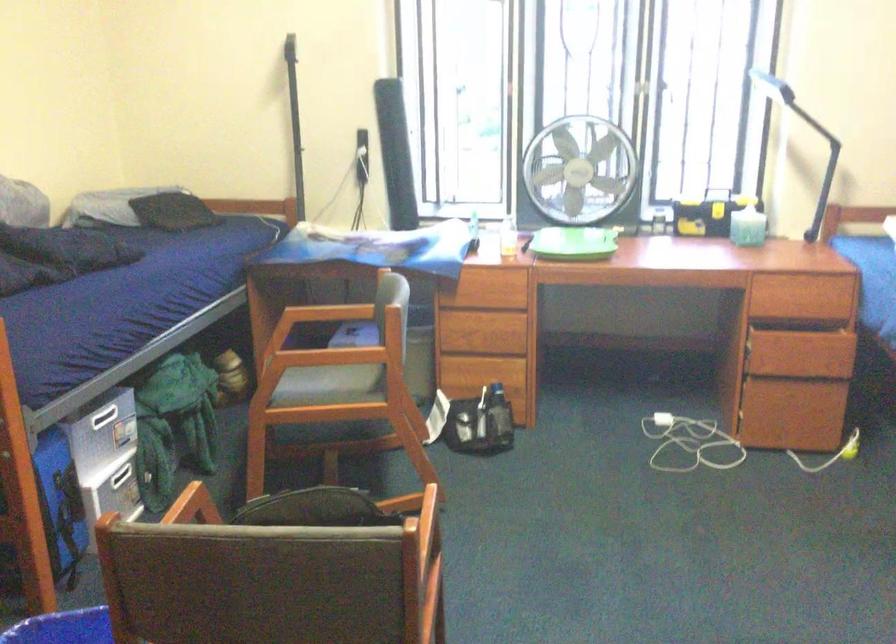
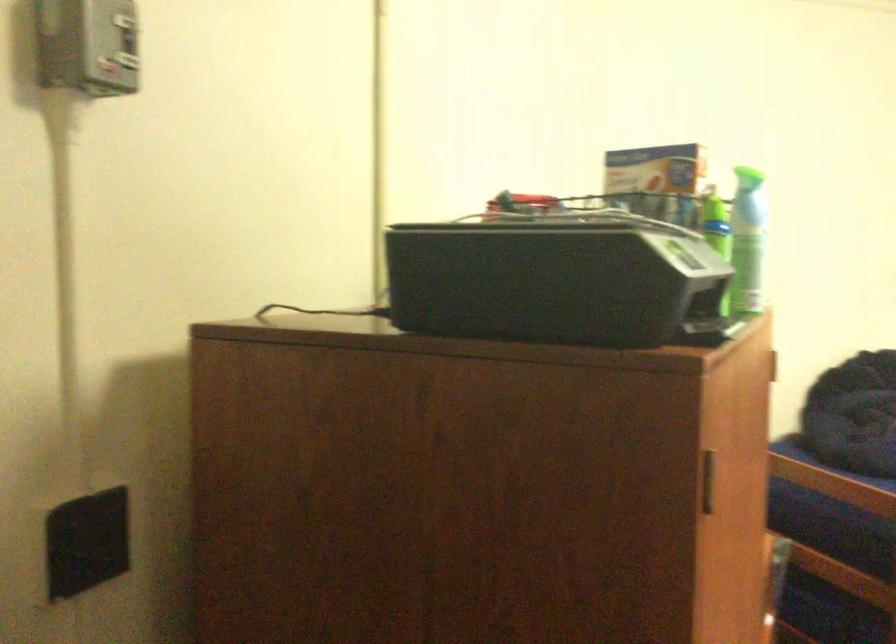
Question: The camera is either moving clockwise (left) or counter-clockwise (right) around the object. The first image is from the beginning of the video and the second image is from the end. Is the camera moving left or right when shooting the video?

Choices:
 (A) Left
 (B) Right

Answer: (B)